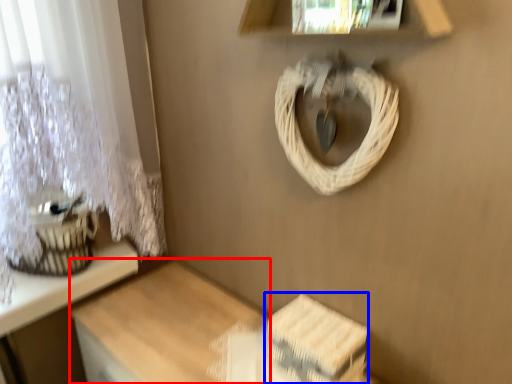
Question: Which point is further to the camera, table (highlighted by a red box) or storage box (highlighted by a blue box)?

Choices:
 (A) table
 (B) storage box

Answer: (B)